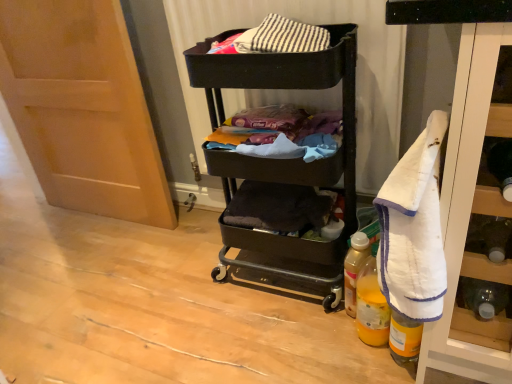
Question: Is translucent plastic bottle at lower right, which appears as the first bottle when viewed from the back, wider or thinner than matte wood door at left?

Choices:
 (A) thin
 (B) wide

Answer: (A)

Question: Is translucent plastic bottle at lower right, positioned as the 3th bottle in front-to-back order, inside or outside of matte wood door at left?

Choices:
 (A) inside
 (B) outside

Answer: (B)

Question: Estimate the real-world distances between objects in this image. Which object is closer to the matte fabric laundry at center?

Choices:
 (A) yellow plastic bottle at lower right, arranged as the third bottle when viewed from the back
 (B) matte wood door at left
 (C) translucent plastic bottle at lower right, positioned as the 3th bottle in front-to-back order
 (D) black matte cart at center
 (E) translucent yellow plastic bottle at lower right, which is the 2th bottle in front-to-back order

Answer: (D)

Question: Estimate the real-world distances between objects in this image. Which object is farther from the translucent plastic bottle at lower right, which appears as the first bottle when viewed from the back?

Choices:
 (A) yellow plastic bottle at lower right, arranged as the third bottle when viewed from the back
 (B) black matte cart at center
 (C) matte fabric laundry at center
 (D) translucent yellow plastic bottle at lower right, the second bottle when ordered from back to front
 (E) matte wood door at left

Answer: (E)